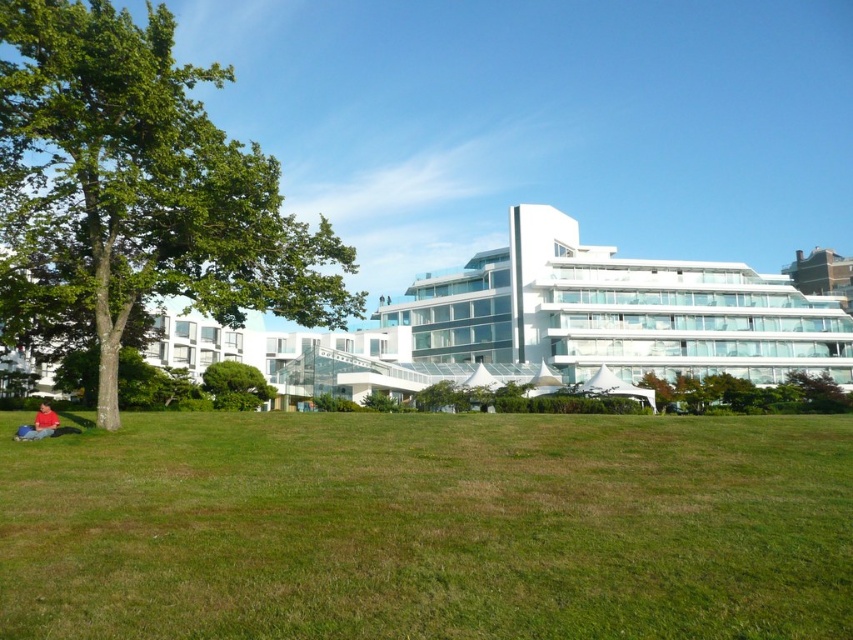
Question: Estimate the real-world distances between objects in this image. Which object is closer to the red cotton shirt at lower left?

Choices:
 (A) green grassy field at lower center
 (B) white glass building at center
 (C) green leafy tree at left
 (D) green leafy tree at center

Answer: (C)

Question: Does green grassy field at lower center appear on the right side of green leafy tree at left?

Choices:
 (A) yes
 (B) no

Answer: (A)

Question: Estimate the real-world distances between objects in this image. Which object is farther from the green leafy tree at left?

Choices:
 (A) red cotton shirt at lower left
 (B) green leafy tree at center
 (C) green grassy field at lower center
 (D) white glass building at center

Answer: (D)

Question: Can you confirm if white glass building at center is smaller than red cotton shirt at lower left?

Choices:
 (A) no
 (B) yes

Answer: (A)

Question: Considering the real-world distances, which object is farthest from the green leafy tree at left?

Choices:
 (A) green leafy tree at center
 (B) white glass building at center
 (C) green grassy field at lower center

Answer: (B)

Question: Can you confirm if green leafy tree at left is positioned above red cotton shirt at lower left?

Choices:
 (A) yes
 (B) no

Answer: (A)